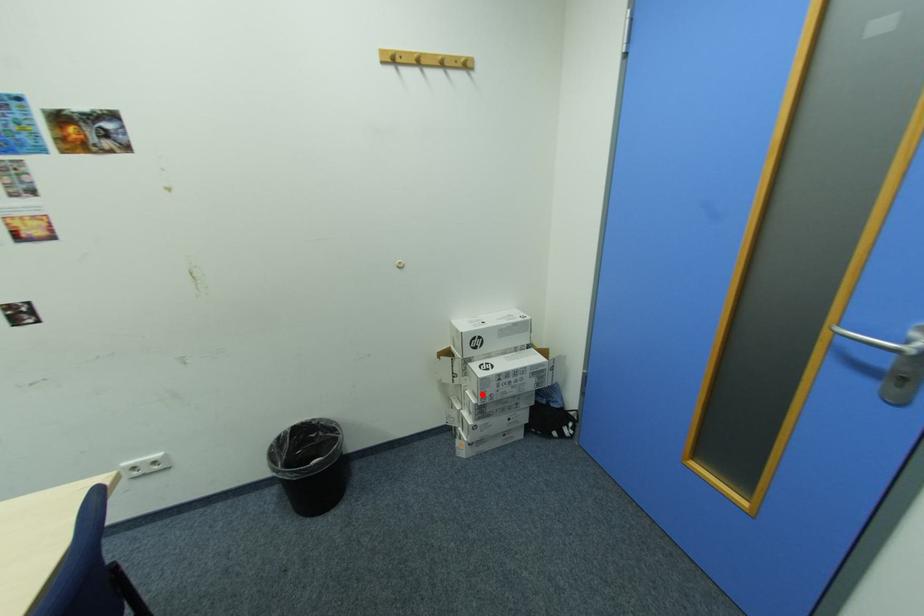
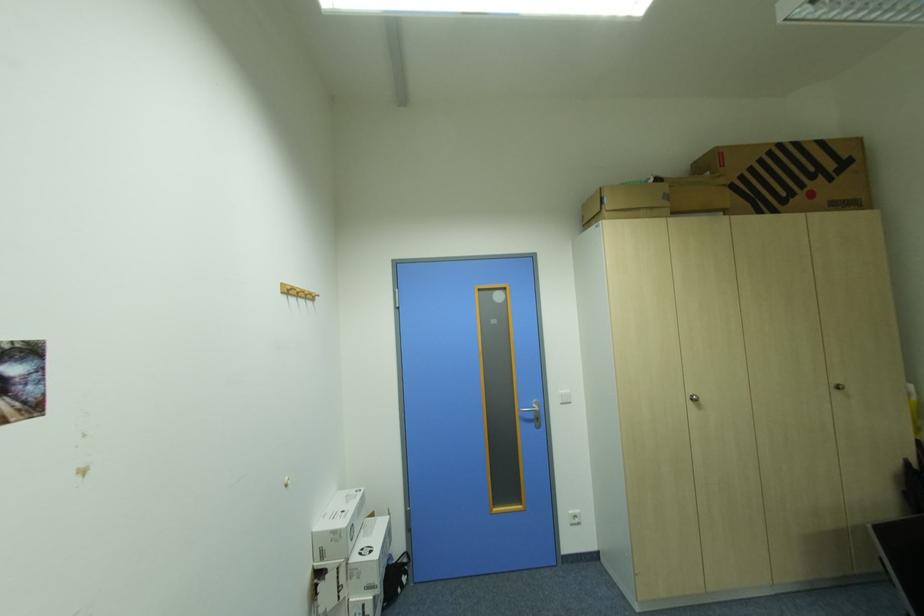
Find the pixel in the second image that matches the highlighted location in the first image.

(377, 590)